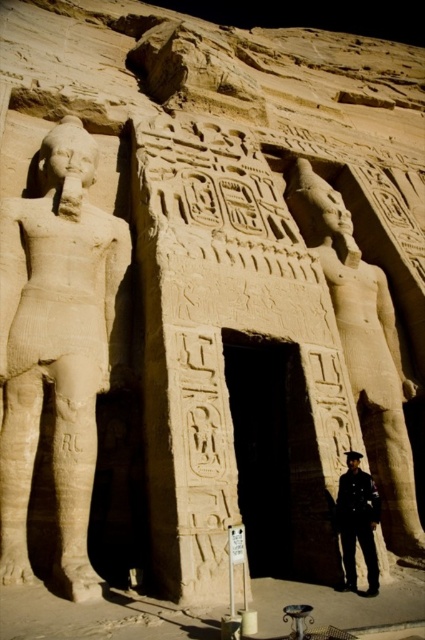
Question: Can you confirm if beige stone statue at left is positioned to the right of dark blue uniform at center?

Choices:
 (A) no
 (B) yes

Answer: (A)

Question: Which of the following is the farthest from the observer?

Choices:
 (A) (42, 316)
 (B) (363, 522)

Answer: (A)

Question: Among these objects, which one is nearest to the camera?

Choices:
 (A) beige stone statue at left
 (B) polished stone statue at center

Answer: (A)

Question: Can you confirm if polished stone statue at center is thinner than dark blue uniform at center?

Choices:
 (A) yes
 (B) no

Answer: (B)

Question: Which point appears closest to the camera in this image?

Choices:
 (A) (357, 468)
 (B) (300, 196)

Answer: (A)

Question: Is beige stone statue at left positioned behind polished stone statue at center?

Choices:
 (A) no
 (B) yes

Answer: (A)